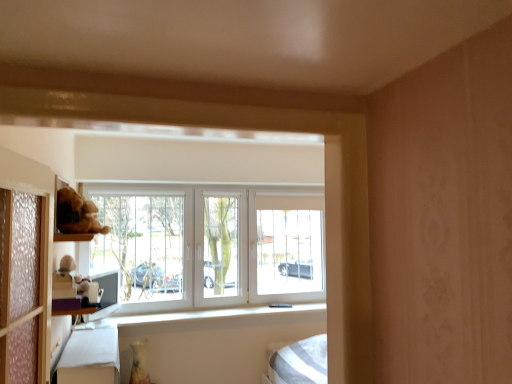
Question: In terms of size, does white fabric bed frame at lower left appear bigger or smaller than white plastic window at center?

Choices:
 (A) big
 (B) small

Answer: (B)

Question: Based on their positions, is white fabric bed frame at lower left located to the left or right of white plastic window at center?

Choices:
 (A) left
 (B) right

Answer: (A)

Question: Estimate the real-world distances between objects in this image. Which object is farther from the white fabric bed frame at lower left?

Choices:
 (A) white plush toy at left
 (B) white plastic window at center

Answer: (B)

Question: Which object is positioned farthest from the white plastic window at center?

Choices:
 (A) white plush toy at left
 (B) white fabric bed frame at lower left

Answer: (A)